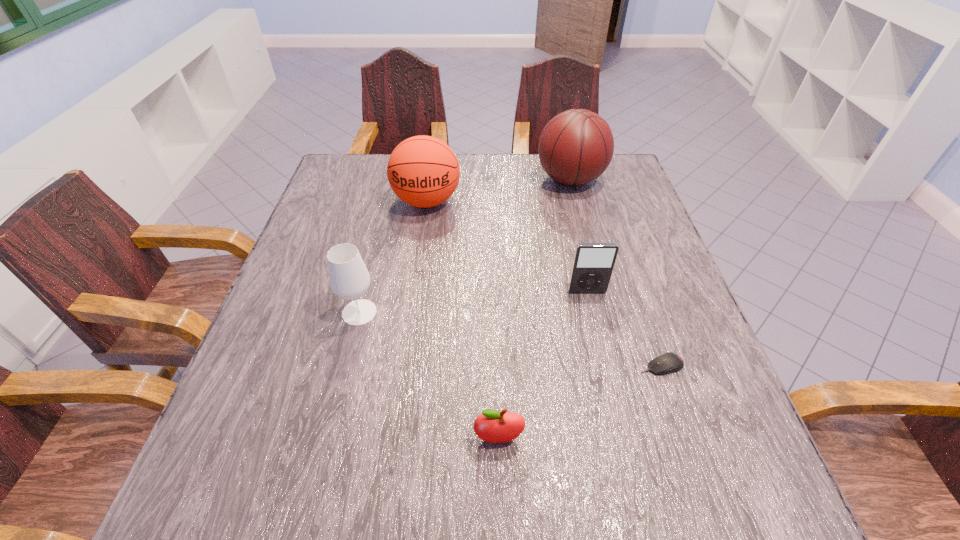
You are a GUI agent. You are given a task and a screenshot of the screen. Output one action in this format:
    pyautogui.click(x=<x>, y=<y>)
    Task: Click on the free point located 0.300m on the side with logo of the left basketball
    Image resolution: width=960 pixels, height=540 pixels.
    Given the screenshot: What is the action you would take?
    pyautogui.click(x=411, y=308)

Where is `free point located on the back of the third nearest object`? This screenshot has height=540, width=960. free point located on the back of the third nearest object is located at coordinates (382, 224).

Image resolution: width=960 pixels, height=540 pixels. I want to click on vacant space situated 0.370m on the front-facing side of the third shortest object, so click(626, 459).

Find the location of a particular element. free space located 0.160m on the back of the nearest object is located at coordinates (496, 353).

Locate an element on the screen. vacant space located 0.260m on the front of the computer mouse is located at coordinates (716, 527).

The image size is (960, 540). I want to click on object that is positioned at the left edge, so click(349, 278).

The width and height of the screenshot is (960, 540). Identify the location of basketball that is at the right edge. (576, 146).

The width and height of the screenshot is (960, 540). Identify the location of computer mouse present at the right edge. (666, 363).

Find the location of a particular element. This screenshot has width=960, height=540. object present at the far right corner is located at coordinates (576, 146).

Where is `vacant position at the far edge of the desktop`? vacant position at the far edge of the desktop is located at coordinates (486, 167).